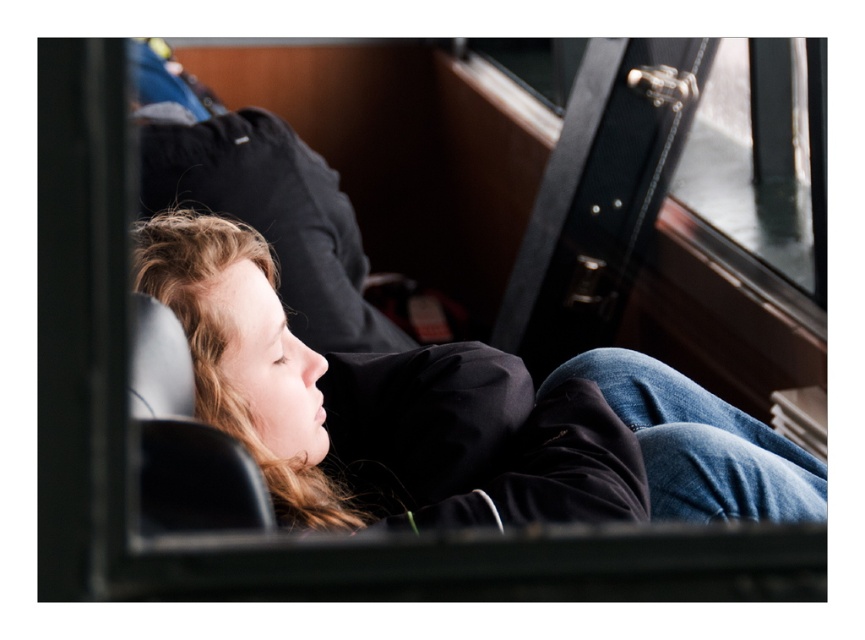
Does black leather chair at left have a larger size compared to black leather window at upper right?

Incorrect, black leather chair at left is not larger than black leather window at upper right.

Is black leather chair at left below black leather window at upper right?

Yes, black leather chair at left is below black leather window at upper right.

Which is in front, point (155, 380) or point (721, 234)?

Positioned in front is point (155, 380).

Where is `black leather chair at left`? The height and width of the screenshot is (640, 865). black leather chair at left is located at coordinates (184, 438).

Between point (218, 308) and point (549, 124), which one is positioned behind?

The point (549, 124) is more distant.

Does matte black jacket at center have a greater height compared to black leather window at upper right?

No.

Image resolution: width=865 pixels, height=640 pixels. Describe the element at coordinates (453, 416) in the screenshot. I see `matte black jacket at center` at that location.

At what (x,y) coordinates should I click in order to perform the action: click on matte black jacket at center. Please return your answer as a coordinate pair (x, y). The width and height of the screenshot is (865, 640). Looking at the image, I should click on [x=453, y=416].

Between matte black jacket at center and black leather chair at left, which one has more height?

matte black jacket at center

Is matte black jacket at center to the left of black leather chair at left from the viewer's perspective?

In fact, matte black jacket at center is to the right of black leather chair at left.

Describe the element at coordinates (453, 416) in the screenshot. The width and height of the screenshot is (865, 640). I see `matte black jacket at center` at that location.

In order to click on matte black jacket at center in this screenshot , I will do 453,416.